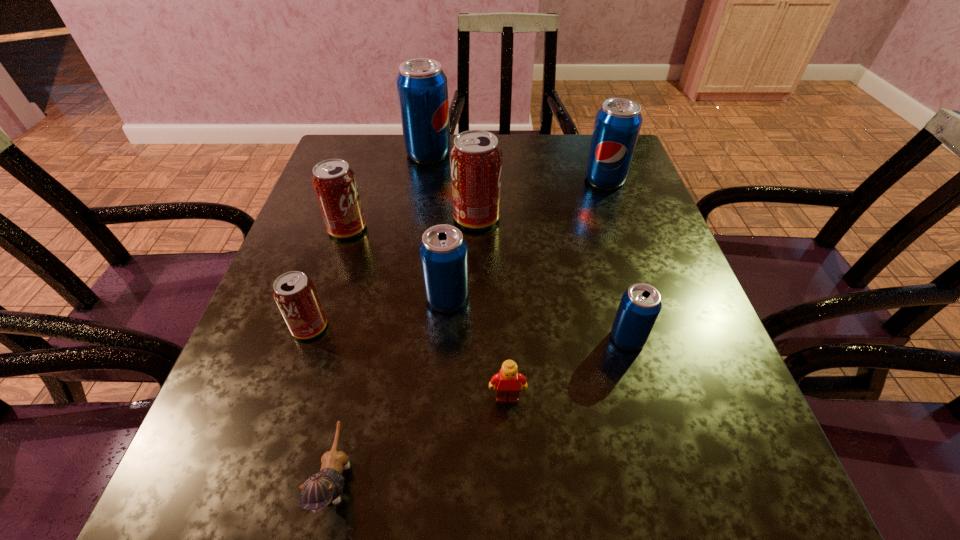
The image size is (960, 540). Find the location of `vacant point located between the eighth farthest object and the third biggest blue pop soda`. vacant point located between the eighth farthest object and the third biggest blue pop soda is located at coordinates (477, 348).

Locate an element on the screen. vacant point located between the Lego and the third biggest blue pop soda is located at coordinates (477, 348).

You are a GUI agent. You are given a task and a screenshot of the screen. Output one action in this format:
    pyautogui.click(x=<x>, y=<y>)
    Task: Click on the free space that is in between the biggest red soda can and the nearest red soda can
    The width and height of the screenshot is (960, 540).
    Given the screenshot: What is the action you would take?
    tap(393, 272)

Identify the location of unoccupied position between the nearest blue pop soda and the second biggest red soda can. (488, 284).

Identify the location of free space between the second smallest red soda can and the second smallest blue pop soda. (397, 264).

You are a GUI agent. You are given a task and a screenshot of the screen. Output one action in this format:
    pyautogui.click(x=<x>, y=<y>)
    Task: Click on the free point between the nearest blue pop soda and the farthest soda can
    The image size is (960, 540).
    Given the screenshot: What is the action you would take?
    pyautogui.click(x=528, y=246)

Identify the location of free space between the second biggest red soda can and the kitten. (342, 354).

Locate an element on the screen. the seventh closest object to the smallest blue pop soda is located at coordinates (334, 182).

The height and width of the screenshot is (540, 960). Identify the location of object that stands as the eighth closest to the nearest red soda can. pyautogui.click(x=617, y=125).

This screenshot has height=540, width=960. Identify the location of the sixth closest soda can to the smallest red soda can. (617, 125).